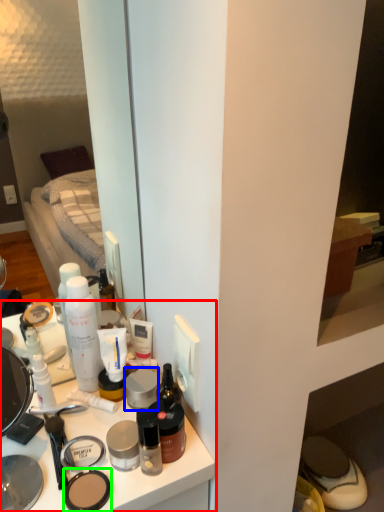
Question: Which object is the farthest from desk (highlighted by a red box)? Choose among these: face powder (highlighted by a blue box) or face powder (highlighted by a green box).

Choices:
 (A) face powder
 (B) face powder

Answer: (A)